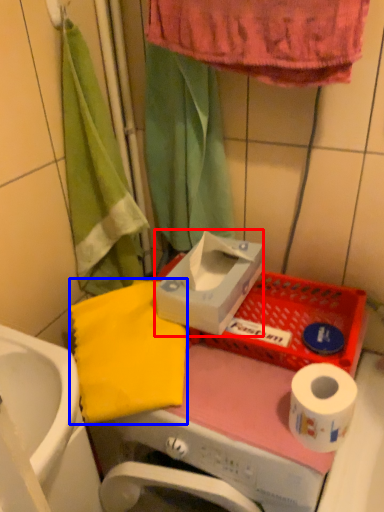
Question: Which point is further to the camera, carton (highlighted by a red box) or beach towel (highlighted by a blue box)?

Choices:
 (A) carton
 (B) beach towel

Answer: (A)